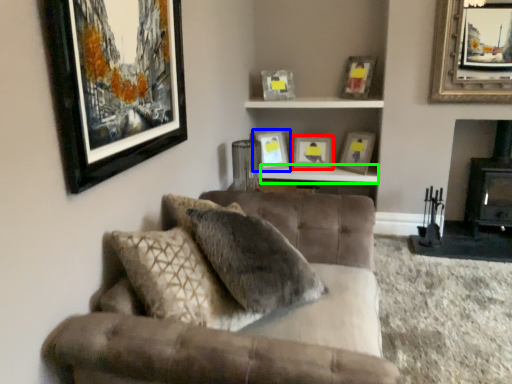
Question: Which object is the closest to the picture frame (highlighted by a red box)? Choose among these: picture frame (highlighted by a blue box) or table (highlighted by a green box).

Choices:
 (A) picture frame
 (B) table

Answer: (B)